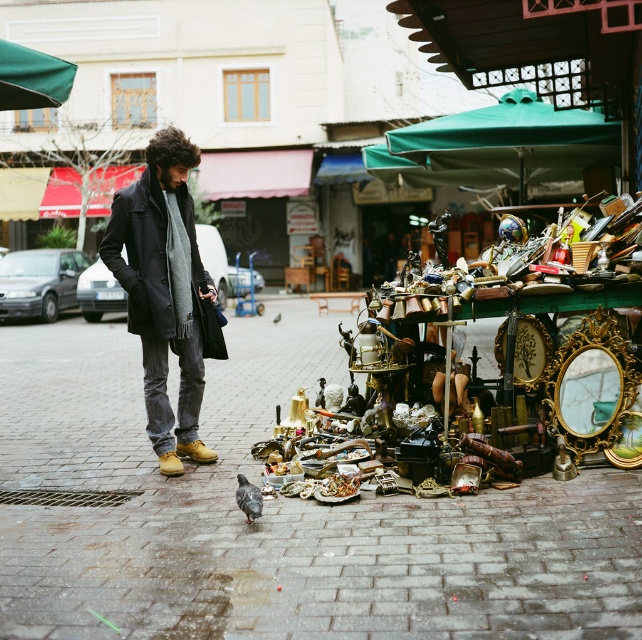
You are a street performer who needs to place a large prop on the ground. You see the brick pavement at center and the dark wool coat at center. Which surface can accommodate the prop without being too small?

The brick pavement at center has a larger size compared to the dark wool coat at center, so the prop can be placed on the brick pavement at center.

You are a photographer trying to capture a clear shot of the brick pavement at center and the dark wool coat at center. Since you want to focus on the lower part of the scene, which object should you aim your camera at to ensure it is in focus without needing to adjust the focus for the other?

The brick pavement at center has a lesser height compared to dark wool coat at center, so aiming the camera at the brick pavement at center will keep it in focus while the dark wool coat at center remains in the same focal plane since they are at different heights.

You are a photographer standing at the edge of the flea market. You want to take a photo of the dark wool coat at center and the brick pavement at center. According to their positions, which object is located to the left of the other?

The brick pavement at center is positioned on the left side of dark wool coat at center, so the brick pavement at center is to the left of the dark wool coat at center.